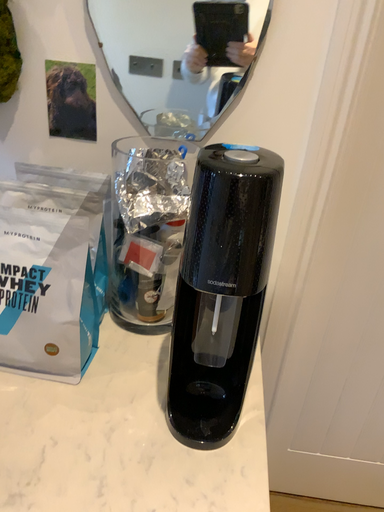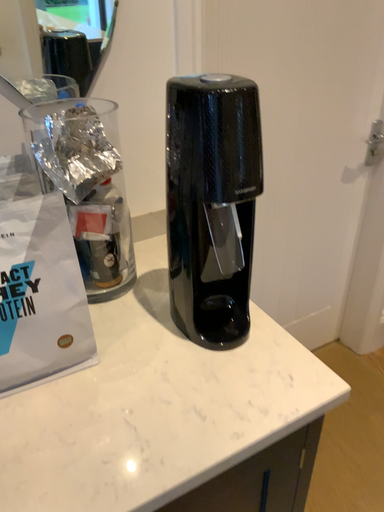
Question: Which way did the camera rotate in the video?

Choices:
 (A) rotated right
 (B) rotated left

Answer: (A)